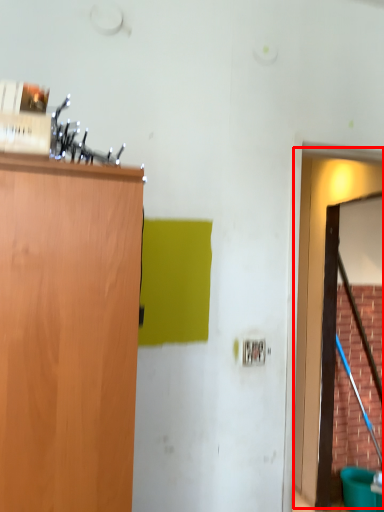
Question: From the image's perspective, considering the relative positions of door (annotated by the red box) and plywood in the image provided, where is door (annotated by the red box) located with respect to the staircase?

Choices:
 (A) below
 (B) above

Answer: (B)